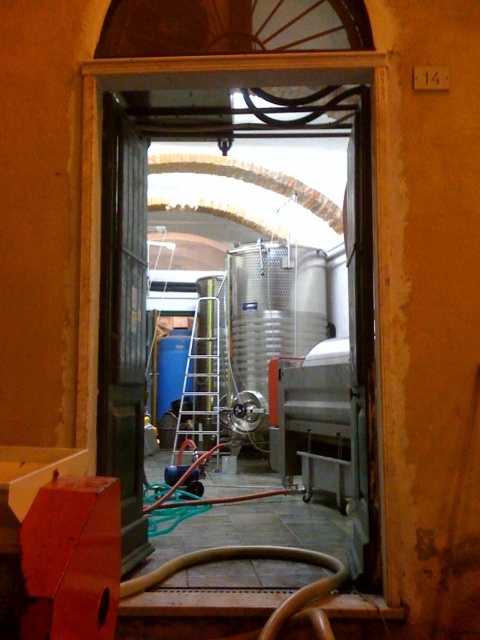
Question: Does black wooden door at left have a greater width compared to silver metallic ladder at center?

Choices:
 (A) no
 (B) yes

Answer: (A)

Question: Is black wooden door at left wider than silver metallic ladder at center?

Choices:
 (A) yes
 (B) no

Answer: (B)

Question: Is black wooden door at left smaller than silver metallic ladder at center?

Choices:
 (A) no
 (B) yes

Answer: (B)

Question: Which object is closer to the camera taking this photo?

Choices:
 (A) black wooden door at left
 (B) silver metallic ladder at center

Answer: (A)

Question: Which point is closer to the camera?

Choices:
 (A) silver metallic ladder at center
 (B) black wooden door at left

Answer: (B)